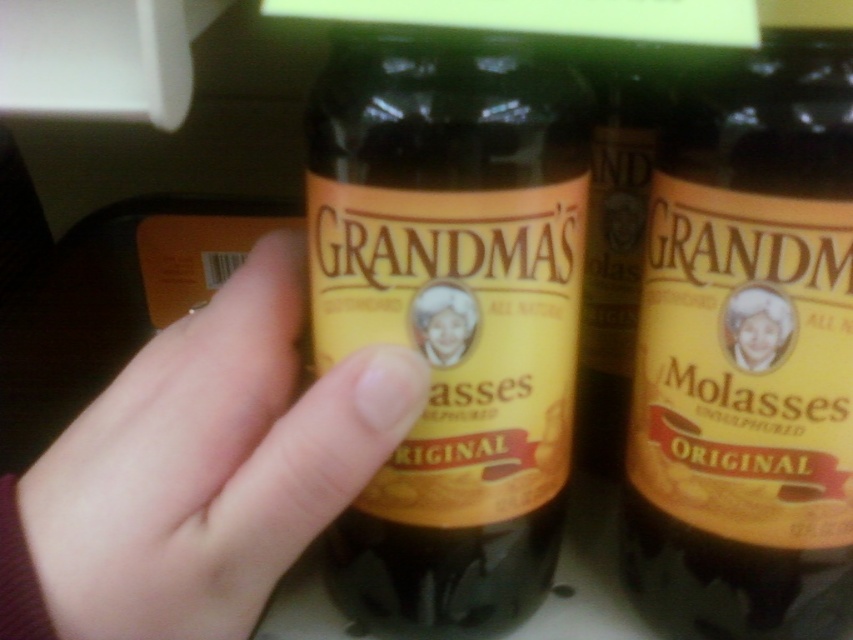
You are trying to place a sticker on the matte glass bottle at center. The sticker is 2.5 inches wide. Can you fit it on the matte yellow label at center without overlapping the edges?

The matte glass bottle at center is 2.66 inches away from the matte yellow label at center. Since the sticker is 2.5 inches wide, which is slightly smaller than the distance between them, you can place the sticker on the matte yellow label at center without overlapping the edges.

You are a quality inspector checking the packaging of the bottles. You notice two elements at the center of the bottle, the smooth skin at center and the matte yellow label at center. Which one has a bigger surface area?

The smooth skin at center has a larger size compared to the matte yellow label at center, so the smooth skin at center has a bigger surface area.